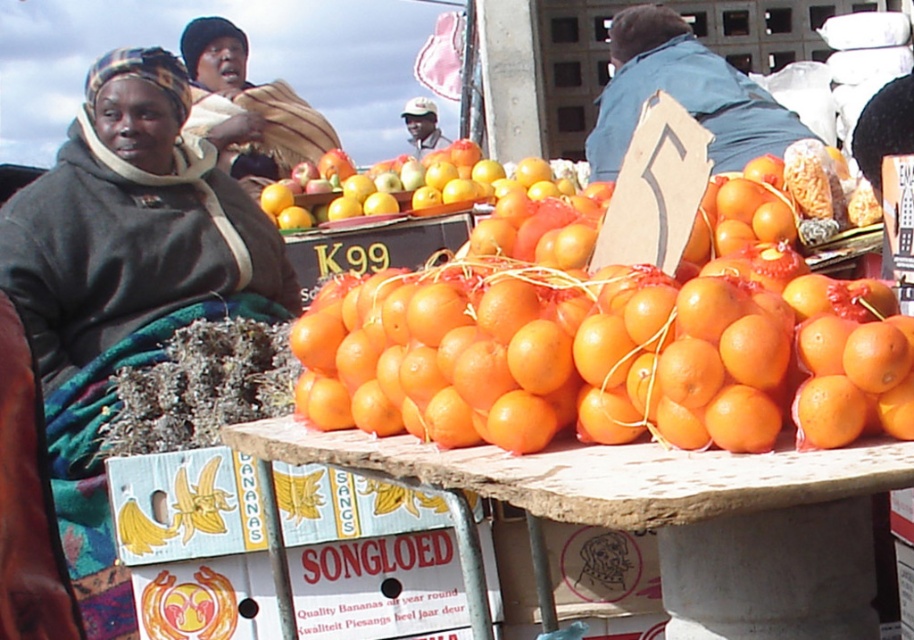
From the picture: Is blue denim jacket at upper center closer to the viewer compared to glossy orange at center?

No.

Identify the location of blue denim jacket at upper center. pyautogui.click(x=682, y=93).

In order to click on blue denim jacket at upper center in this screenshot , I will do `click(682, 93)`.

Locate an element on the screen. blue denim jacket at upper center is located at coordinates (682, 93).

Which of these two, smooth wooden table at center or glossy orange at center, stands shorter?

smooth wooden table at center is shorter.

Which is below, smooth wooden table at center or glossy orange at center?

smooth wooden table at center is below.

Does point (784, 474) come farther from viewer compared to point (517, 385)?

No, (784, 474) is in front of (517, 385).

Identify the location of smooth wooden table at center. (599, 472).

Is smooth wooden table at center thinner than blue denim jacket at upper center?

Incorrect, smooth wooden table at center's width is not less than blue denim jacket at upper center's.

Who is higher up, smooth wooden table at center or blue denim jacket at upper center?

blue denim jacket at upper center is higher up.

Does point (367, 454) come closer to viewer compared to point (771, 131)?

Yes.

Image resolution: width=914 pixels, height=640 pixels. I want to click on smooth wooden table at center, so click(x=599, y=472).